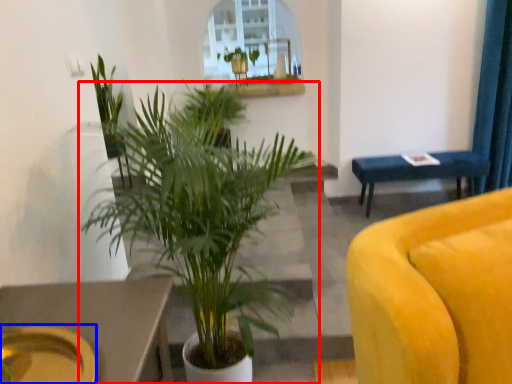
Question: Which point is closer to the camera, houseplant (highlighted by a red box) or platter (highlighted by a blue box)?

Choices:
 (A) houseplant
 (B) platter

Answer: (B)